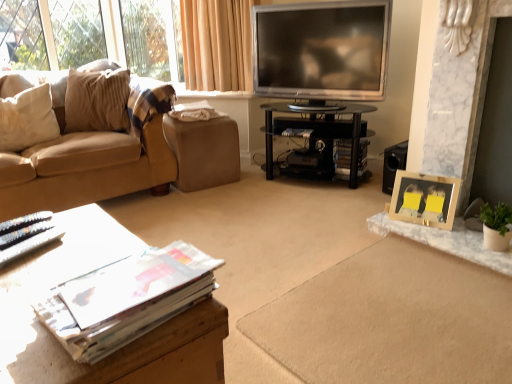
The height and width of the screenshot is (384, 512). I want to click on blank space to the left of wooden photo frame at right, so click(x=395, y=218).